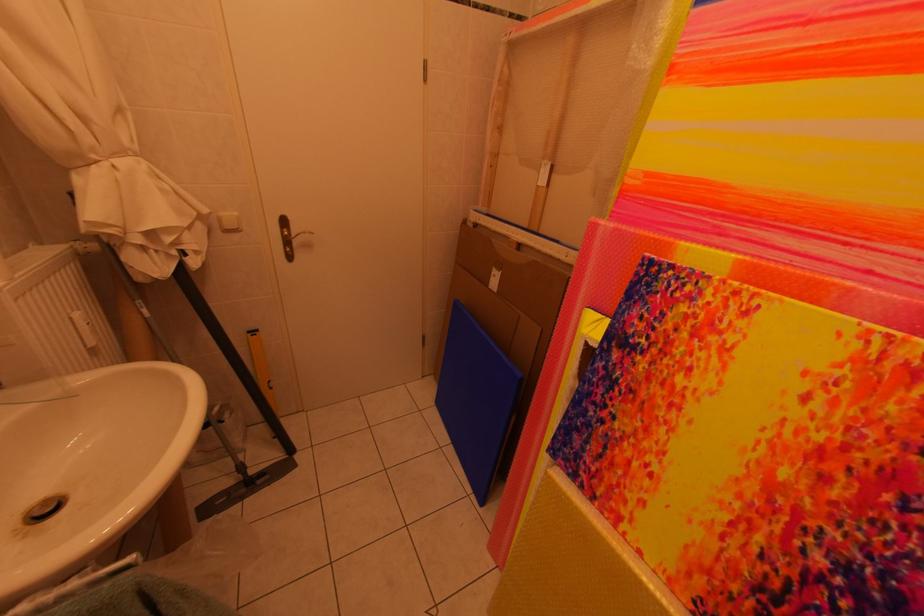
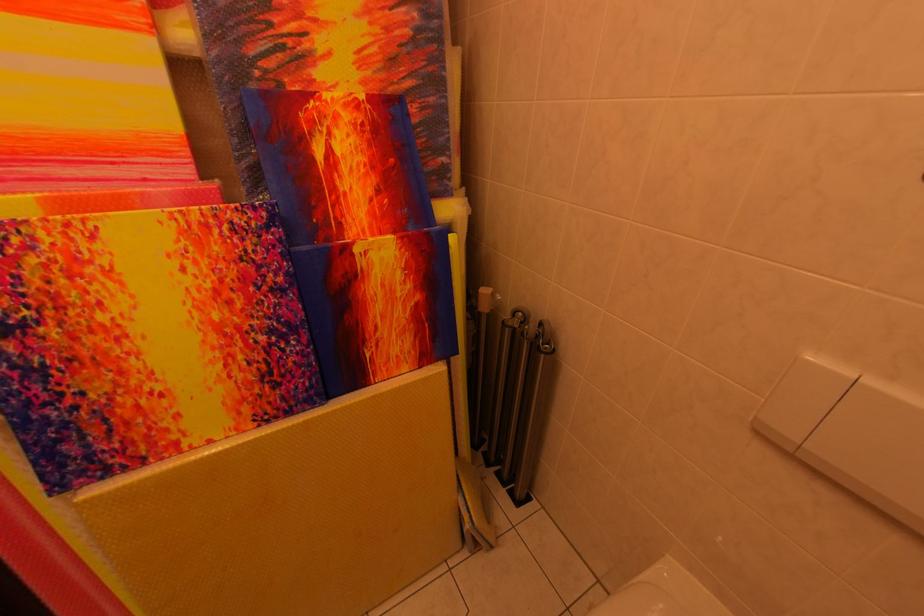
From the picture: The first image is from the beginning of the video and the second image is from the end. How did the camera likely rotate when shooting the video?

The camera's rotation is toward right-down.